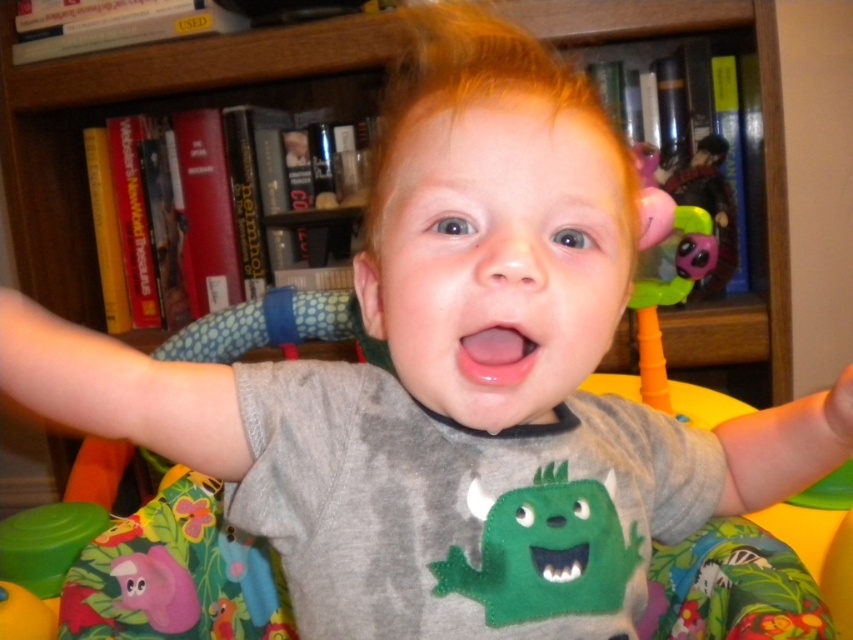
Question: Does translucent plastic toy at upper right appear on the left side of pink glossy mouth at center?

Choices:
 (A) yes
 (B) no

Answer: (B)

Question: Which point is farther to the camera?

Choices:
 (A) (74, 72)
 (B) (650, 280)

Answer: (A)

Question: Which point is closer to the camera?

Choices:
 (A) (645, 292)
 (B) (498, 337)
 (C) (248, 76)
 (D) (584, 604)

Answer: (B)

Question: Is translucent plastic toy at upper right closer to camera compared to pink glossy mouth at center?

Choices:
 (A) no
 (B) yes

Answer: (A)

Question: Considering the real-world distances, which object is farthest from the wooden bookshelf at upper center?

Choices:
 (A) translucent plastic toy at upper right
 (B) pink glossy mouth at center
 (C) green felt monster at center

Answer: (B)

Question: Is green felt monster at center further to camera compared to translucent plastic toy at upper right?

Choices:
 (A) no
 (B) yes

Answer: (A)